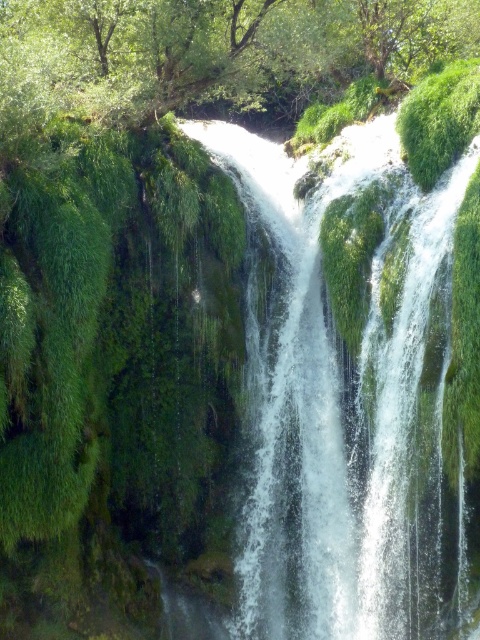
Question: Can you confirm if white frothy water at center is positioned to the right of green mossy tree at upper center?

Choices:
 (A) yes
 (B) no

Answer: (A)

Question: Among these objects, which one is nearest to the camera?

Choices:
 (A) white frothy water at center
 (B) green mossy tree at upper center

Answer: (A)

Question: Is white frothy water at center bigger than green mossy tree at upper center?

Choices:
 (A) yes
 (B) no

Answer: (B)

Question: Which of the following is the farthest from the observer?

Choices:
 (A) green mossy tree at upper center
 (B) white frothy water at center

Answer: (A)

Question: Is white frothy water at center smaller than green mossy tree at upper center?

Choices:
 (A) yes
 (B) no

Answer: (A)